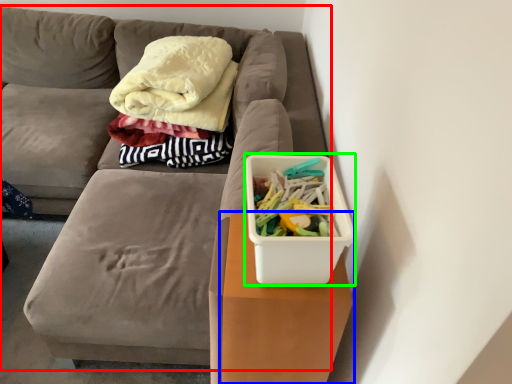
Question: Which is farther away from furniture (highlighted by a red box)? table (highlighted by a blue box) or storage box (highlighted by a green box)?

Choices:
 (A) table
 (B) storage box

Answer: (B)